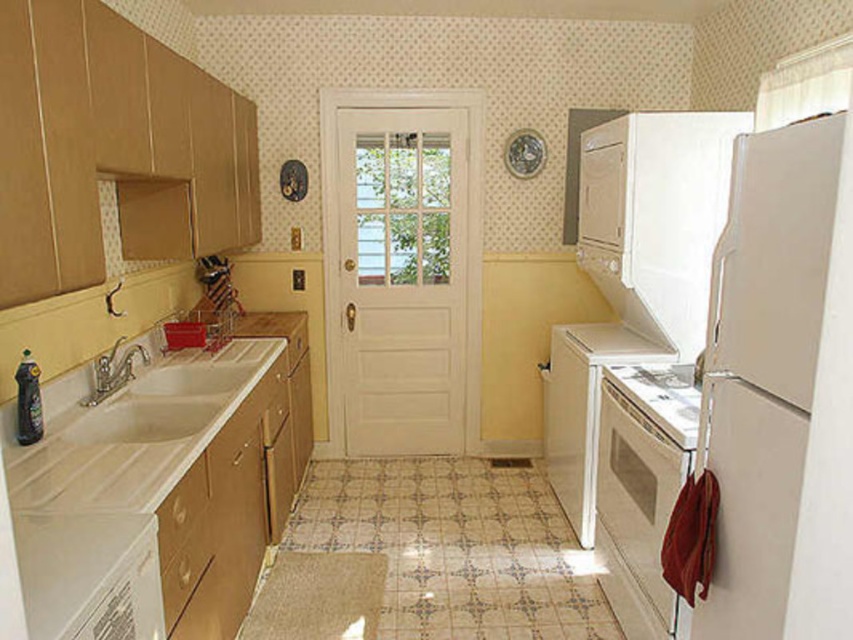
Question: Can you confirm if white glossy countertop at lower left is wider than white glossy sink at left?

Choices:
 (A) no
 (B) yes

Answer: (B)

Question: Based on their relative distances, which object is farther from the white glossy stove at lower center?

Choices:
 (A) white glossy refrigerator at right
 (B) white matte refrigerator at right
 (C) white glossy countertop at lower left

Answer: (C)

Question: Does white glossy oven at lower right have a greater width compared to white glossy sink at left?

Choices:
 (A) yes
 (B) no

Answer: (B)

Question: Which of the following is the farthest from the observer?

Choices:
 (A) white glossy refrigerator at right
 (B) white matte refrigerator at right

Answer: (A)

Question: Which is farther from the white glossy countertop at lower left?

Choices:
 (A) white glossy refrigerator at right
 (B) white matte refrigerator at right
 (C) white glossy sink at left

Answer: (A)

Question: Is white glossy oven at lower right below white glossy sink at left?

Choices:
 (A) yes
 (B) no

Answer: (A)